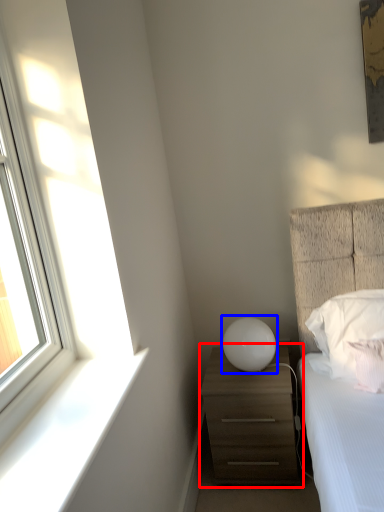
Question: Which point is further to the camera, chest of drawers (highlighted by a red box) or table lamp (highlighted by a blue box)?

Choices:
 (A) chest of drawers
 (B) table lamp

Answer: (B)